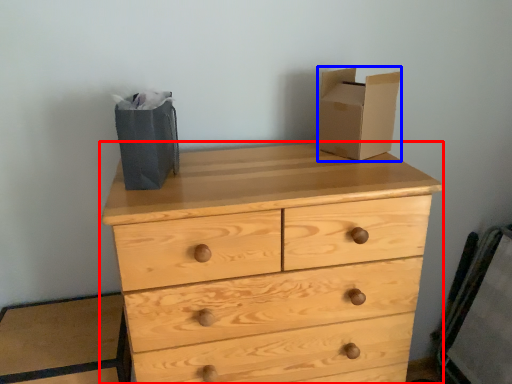
Question: Which point is closer to the camera, chest of drawers (highlighted by a red box) or cardboard box (highlighted by a blue box)?

Choices:
 (A) chest of drawers
 (B) cardboard box

Answer: (A)